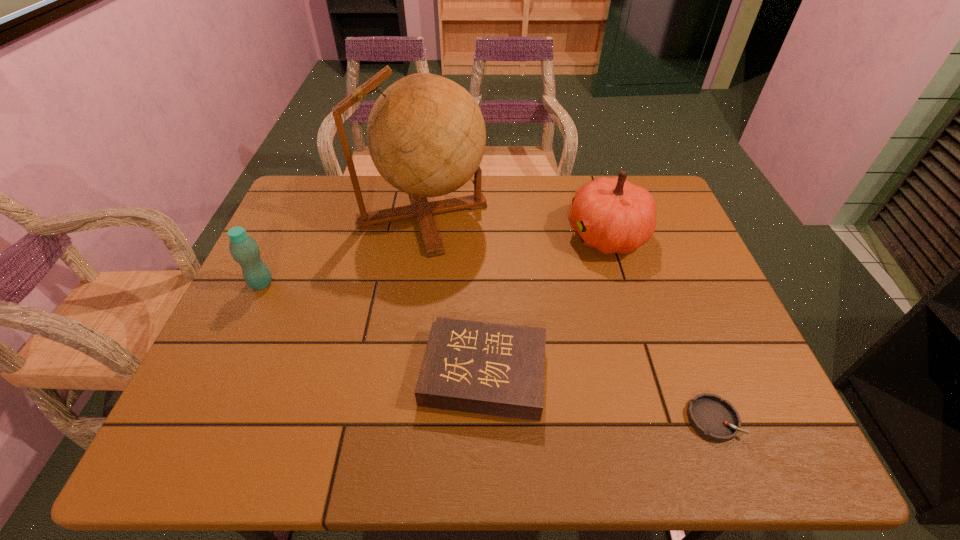
Locate an element on the screen. The width and height of the screenshot is (960, 540). free space in the image that satisfies the following two spatial constraints: 1. at the front cap of the hardback book; 2. on the left side of the water bottle is located at coordinates (220, 373).

Find the location of `vacant space that satisfies the following two spatial constraints: 1. on the front side of the shortest object; 2. on the right side of the hardback book`. vacant space that satisfies the following two spatial constraints: 1. on the front side of the shortest object; 2. on the right side of the hardback book is located at coordinates (485, 419).

Image resolution: width=960 pixels, height=540 pixels. I want to click on vacant area in the image that satisfies the following two spatial constraints: 1. on the surface of the globe; 2. on the back side of the hardback book, so click(400, 373).

Image resolution: width=960 pixels, height=540 pixels. In order to click on vacant point that satisfies the following two spatial constraints: 1. on the surface of the tallest object; 2. on the right side of the fourth tallest object in this screenshot , I will do `click(400, 373)`.

Locate an element on the screen. This screenshot has height=540, width=960. vacant space that satisfies the following two spatial constraints: 1. on the front side of the hardback book; 2. on the right side of the ashtray is located at coordinates (485, 419).

At what (x,y) coordinates should I click in order to perform the action: click on free space that satisfies the following two spatial constraints: 1. on the surface of the tallest object; 2. on the right side of the ashtray. Please return your answer as a coordinate pair (x, y). This screenshot has width=960, height=540. Looking at the image, I should click on (394, 419).